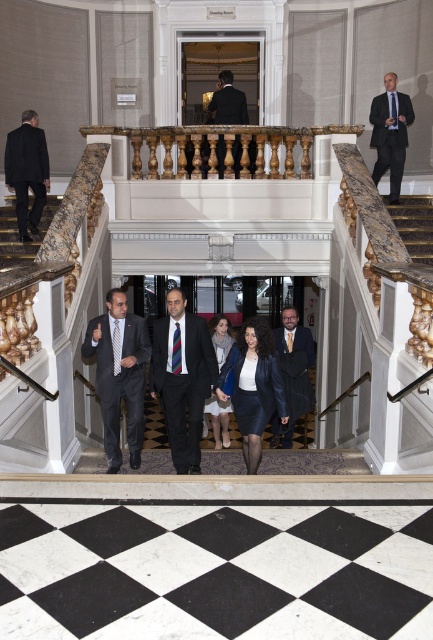
You are a photographer positioned at the bottom of the staircase and want to capture both the matte black suit at center and the matte black suit at left in a single frame. Which of the two suits should you focus on first to ensure both are in the frame without needing to adjust your camera angle?

You should focus on the matte black suit at left first because it is taller than the matte black suit at center, so keeping it in frame ensures the shorter one is also captured.

You are standing at the top of the staircase and want to greet the two people wearing matte black suits. Which one is closer to you, the matte black suit at center or the matte black suit at left?

The matte black suit at center is closer to you because it is located below the matte black suit at left, meaning it is positioned lower on the staircase.